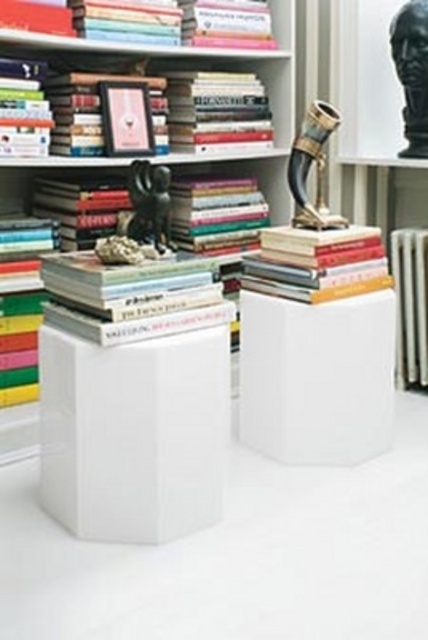
Question: From the image, what is the correct spatial relationship of white glossy bookcase at center in relation to hardcover books at upper center?

Choices:
 (A) below
 (B) above

Answer: (B)

Question: Which point appears farthest from the camera in this image?

Choices:
 (A) (62, 125)
 (B) (285, 86)

Answer: (B)

Question: Which of the following is the closest to the observer?

Choices:
 (A) hardcover books at upper center
 (B) hardcover book at upper center
 (C) hardcover books at center

Answer: (B)

Question: Is hardcover books at upper center smaller than hardcover books at center?

Choices:
 (A) no
 (B) yes

Answer: (A)

Question: Which point is closer to the camera taking this photo?

Choices:
 (A) (85, 164)
 (B) (344, 244)
 (C) (6, 1)
 (D) (231, 140)

Answer: (C)

Question: Is hardcover books at upper center further to the viewer compared to hardcover books at center?

Choices:
 (A) no
 (B) yes

Answer: (A)